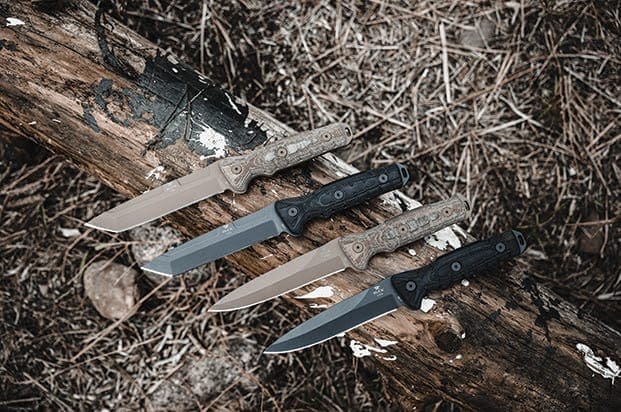
The width and height of the screenshot is (621, 412). Identify the location of 2 light brown handles. (419, 233), (274, 158).